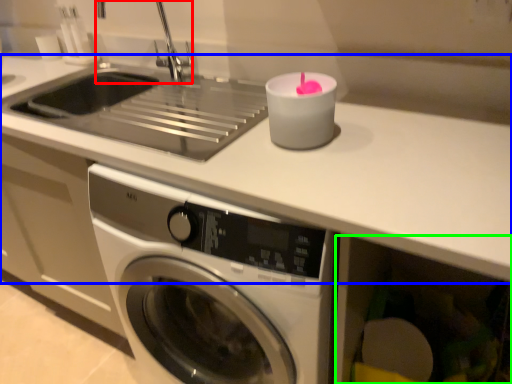
Question: Based on their relative distances, which object is nearer to faucet (highlighted by a red box)? Choose from counter top (highlighted by a blue box) and drawer (highlighted by a green box).

Choices:
 (A) counter top
 (B) drawer

Answer: (A)